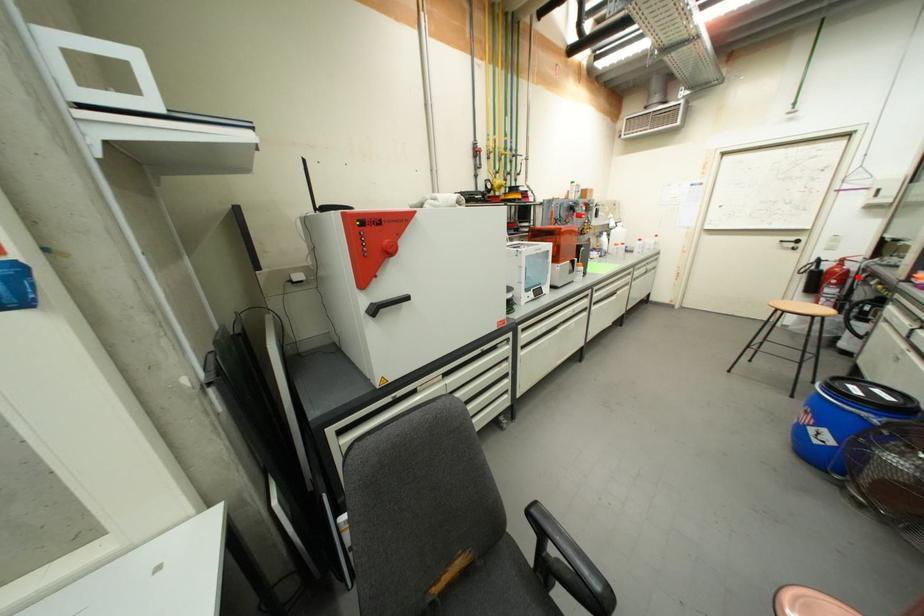
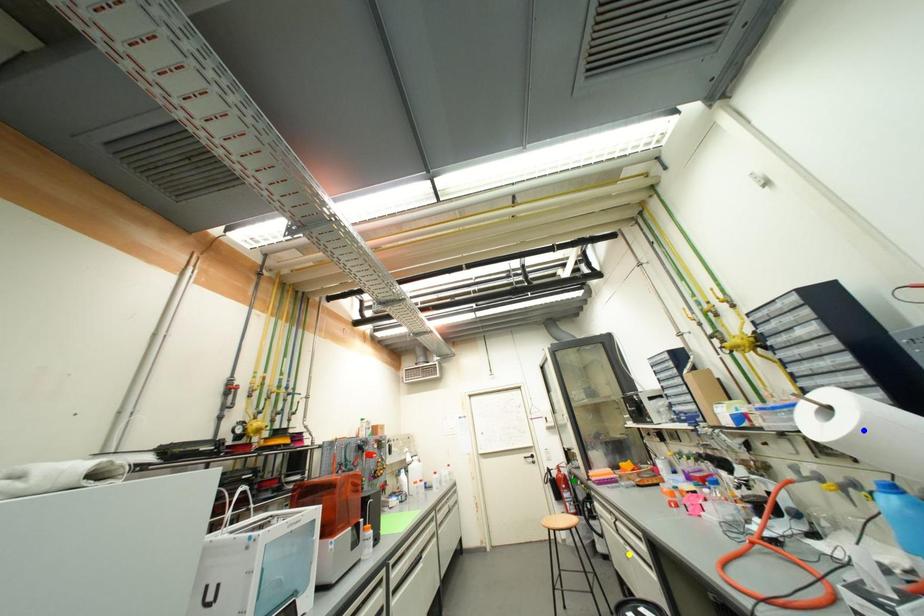
Question: I am providing you with two images of the same scene from different viewpoints. A red point is marked on the first image. You are given multiple points on the second image. In image 2, which mark is for the same physical point as the one in image 1?

Choices:
 (A) green point
 (B) blue point
 (C) yellow point

Answer: (A)